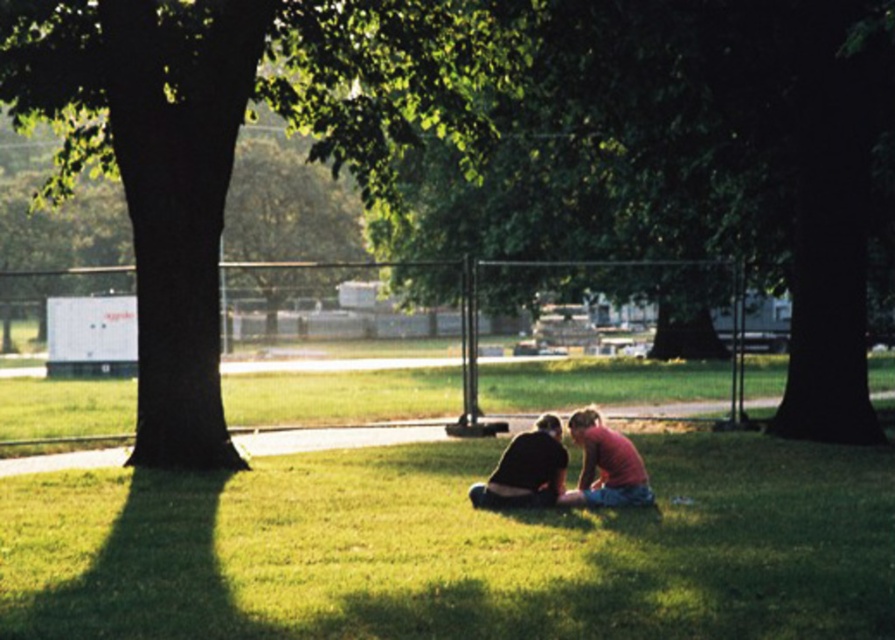
Question: Is green grassy at center bigger than green leafy tree at center?

Choices:
 (A) no
 (B) yes

Answer: (A)

Question: Can you confirm if green grassy at center is positioned to the right of matte pink shirt at center?

Choices:
 (A) no
 (B) yes

Answer: (A)

Question: Which point is farther from the camera taking this photo?

Choices:
 (A) (206, 522)
 (B) (610, 506)
 (C) (550, 436)

Answer: (B)

Question: Is pink fabric couple at center below dark brown leather jacket at center?

Choices:
 (A) no
 (B) yes

Answer: (A)

Question: Among these points, which one is nearest to the camera?

Choices:
 (A) (155, 10)
 (B) (561, 484)
 (C) (669, 486)

Answer: (B)

Question: Which object is the farthest from the pink fabric couple at center?

Choices:
 (A) green grassy at center
 (B) dark brown leather jacket at center

Answer: (A)